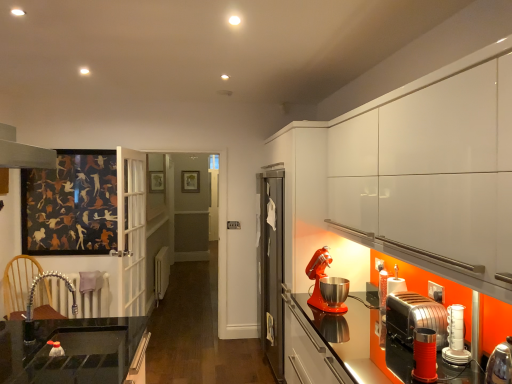
Question: Does metallic red stand mixer at right, the fourth kitchen appliance from the front, contain wooden picture frame at center?

Choices:
 (A) no
 (B) yes

Answer: (A)

Question: Is metallic red stand mixer at right, placed as the first kitchen appliance when sorted from back to front, oriented towards wooden picture frame at center?

Choices:
 (A) yes
 (B) no

Answer: (B)

Question: From the image's perspective, is metallic red stand mixer at right, placed as the first kitchen appliance when sorted from back to front, located above wooden picture frame at center?

Choices:
 (A) yes
 (B) no

Answer: (B)

Question: Are metallic red stand mixer at right, the fourth kitchen appliance from the front, and wooden picture frame at center located far from each other?

Choices:
 (A) yes
 (B) no

Answer: (A)

Question: Is metallic red stand mixer at right, the fourth kitchen appliance from the front, turned away from wooden picture frame at center?

Choices:
 (A) no
 (B) yes

Answer: (A)

Question: From a real-world perspective, is metallic red stand mixer at right, placed as the first kitchen appliance when sorted from back to front, located beneath wooden picture frame at center?

Choices:
 (A) no
 (B) yes

Answer: (B)

Question: Considering the relative sizes of metallic red stand mixer at right, the fourth kitchen appliance from the front, and white glossy toaster at lower right, the second kitchen appliance when ordered from front to back, in the image provided, is metallic red stand mixer at right, the fourth kitchen appliance from the front, shorter than white glossy toaster at lower right, the second kitchen appliance when ordered from front to back,?

Choices:
 (A) no
 (B) yes

Answer: (A)

Question: From the image's perspective, is metallic red stand mixer at right, the fourth kitchen appliance from the front, above white glossy toaster at lower right, the second kitchen appliance when ordered from front to back?

Choices:
 (A) yes
 (B) no

Answer: (A)

Question: Can we say metallic red stand mixer at right, placed as the first kitchen appliance when sorted from back to front, lies outside white glossy toaster at lower right, the 3th kitchen appliance when ordered from back to front?

Choices:
 (A) yes
 (B) no

Answer: (A)

Question: Does metallic red stand mixer at right, placed as the first kitchen appliance when sorted from back to front, have a smaller size compared to white glossy toaster at lower right, the second kitchen appliance when ordered from front to back?

Choices:
 (A) no
 (B) yes

Answer: (A)

Question: Does metallic red stand mixer at right, placed as the first kitchen appliance when sorted from back to front, turn towards white glossy toaster at lower right, the 3th kitchen appliance when ordered from back to front?

Choices:
 (A) no
 (B) yes

Answer: (A)

Question: From a real-world perspective, is metallic red stand mixer at right, the fourth kitchen appliance from the front, located higher than white glossy toaster at lower right, the second kitchen appliance when ordered from front to back?

Choices:
 (A) no
 (B) yes

Answer: (B)

Question: Does metallic red toaster at lower right, positioned as the 1th kitchen appliance in front-to-back order, have a larger size compared to wooden picture frame at center?

Choices:
 (A) yes
 (B) no

Answer: (B)